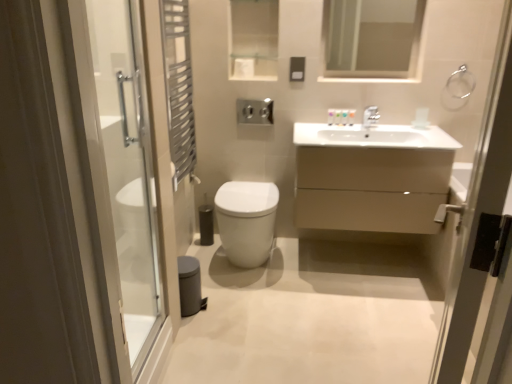
Question: Can we say metallic silver towel rack at left lies outside matte beige cabinet at center?

Choices:
 (A) no
 (B) yes

Answer: (B)

Question: Does metallic silver towel rack at left have a lesser width compared to matte beige cabinet at center?

Choices:
 (A) no
 (B) yes

Answer: (B)

Question: Does metallic silver towel rack at left have a smaller size compared to matte beige cabinet at center?

Choices:
 (A) no
 (B) yes

Answer: (B)

Question: Does metallic silver towel rack at left have a larger size compared to matte beige cabinet at center?

Choices:
 (A) yes
 (B) no

Answer: (B)

Question: Is metallic silver towel rack at left taller than matte beige cabinet at center?

Choices:
 (A) no
 (B) yes

Answer: (B)

Question: Could you tell me if metallic silver towel rack at left is turned towards matte beige cabinet at center?

Choices:
 (A) yes
 (B) no

Answer: (A)

Question: Is clear glass mirror at upper center inside matte beige cabinet at center?

Choices:
 (A) no
 (B) yes

Answer: (A)

Question: Is the position of matte beige cabinet at center less distant than that of clear glass mirror at upper center?

Choices:
 (A) yes
 (B) no

Answer: (A)

Question: Considering the relative positions of matte beige cabinet at center and clear glass mirror at upper center in the image provided, is matte beige cabinet at center to the left of clear glass mirror at upper center from the viewer's perspective?

Choices:
 (A) no
 (B) yes

Answer: (B)

Question: From the image's perspective, is matte beige cabinet at center above clear glass mirror at upper center?

Choices:
 (A) yes
 (B) no

Answer: (B)

Question: Does matte beige cabinet at center have a smaller size compared to clear glass mirror at upper center?

Choices:
 (A) no
 (B) yes

Answer: (A)

Question: From a real-world perspective, does matte beige cabinet at center sit lower than clear glass mirror at upper center?

Choices:
 (A) no
 (B) yes

Answer: (B)

Question: Is the position of matte beige cabinet at center less distant than that of metallic silver towel ring at right, which ranks as the second screen door in left-to-right order?

Choices:
 (A) no
 (B) yes

Answer: (A)